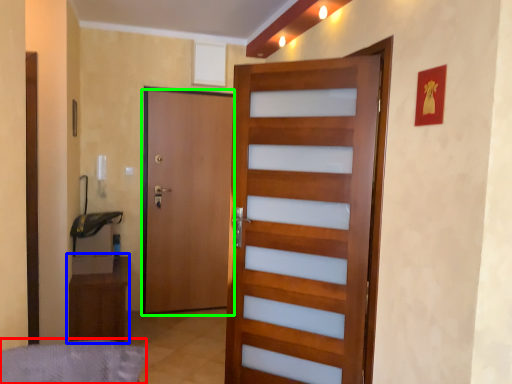
Question: Which is nearer to the bed frame (highlighted by a red box)? furniture (highlighted by a blue box) or door (highlighted by a green box).

Choices:
 (A) furniture
 (B) door

Answer: (A)